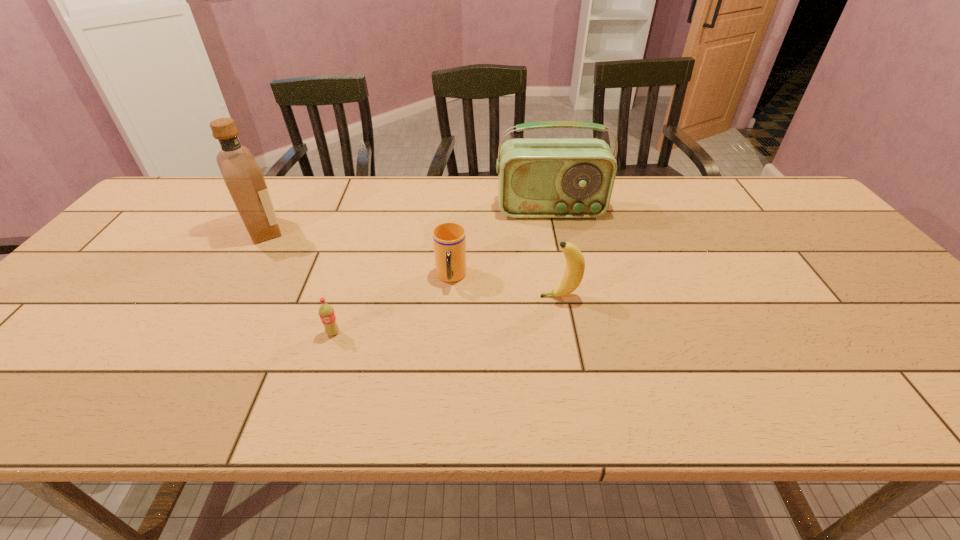
Choose which object is the nearest neighbor to the soda. Please provide its 2D coordinates. Your answer should be formatted as a tuple, i.e. [(x, y)], where the tuple contains the x and y coordinates of a point satisfying the conditions above.

[(449, 240)]

The image size is (960, 540). What are the coordinates of `object that ranks as the fourth closest to the liquor` in the screenshot? It's located at (575, 263).

Where is `free spot that satisfies the following two spatial constraints: 1. on the front panel of the second tallest object; 2. on the front-facing side of the tallest object`? The height and width of the screenshot is (540, 960). free spot that satisfies the following two spatial constraints: 1. on the front panel of the second tallest object; 2. on the front-facing side of the tallest object is located at coordinates (555, 230).